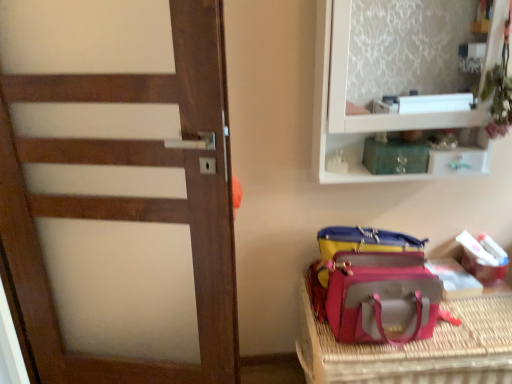
Question: From the image's perspective, does pink fabric bag at lower right appear lower than white glossy cabinet at upper right?

Choices:
 (A) no
 (B) yes

Answer: (B)

Question: Is pink fabric bag at lower right surrounding white glossy cabinet at upper right?

Choices:
 (A) yes
 (B) no

Answer: (B)

Question: Does pink fabric bag at lower right have a smaller size compared to white glossy cabinet at upper right?

Choices:
 (A) no
 (B) yes

Answer: (B)

Question: Is pink fabric bag at lower right not close to white glossy cabinet at upper right?

Choices:
 (A) yes
 (B) no

Answer: (B)

Question: Does pink fabric bag at lower right have a lesser height compared to white glossy cabinet at upper right?

Choices:
 (A) yes
 (B) no

Answer: (A)

Question: Is pink fabric bag at lower right facing away from white glossy cabinet at upper right?

Choices:
 (A) no
 (B) yes

Answer: (A)

Question: From a real-world perspective, does white cardboard box at lower right, which appears as the 1th kit when viewed from the back, sit lower than white glossy cabinet at upper right?

Choices:
 (A) yes
 (B) no

Answer: (A)

Question: Is white glossy cabinet at upper right surrounded by white cardboard box at lower right, the first kit when ordered from bottom to top?

Choices:
 (A) no
 (B) yes

Answer: (A)

Question: Is the surface of white cardboard box at lower right, which is the 1th kit in right-to-left order, in direct contact with white glossy cabinet at upper right?

Choices:
 (A) yes
 (B) no

Answer: (B)

Question: Is white cardboard box at lower right, marked as the second kit in a front-to-back arrangement, at the left side of white glossy cabinet at upper right?

Choices:
 (A) no
 (B) yes

Answer: (A)

Question: Considering the relative sizes of white cardboard box at lower right, which appears as the 1th kit when viewed from the back, and white glossy cabinet at upper right in the image provided, is white cardboard box at lower right, which appears as the 1th kit when viewed from the back, thinner than white glossy cabinet at upper right?

Choices:
 (A) no
 (B) yes

Answer: (B)

Question: From the image's perspective, is white cardboard box at lower right, which is the 1th kit in right-to-left order, above white glossy cabinet at upper right?

Choices:
 (A) yes
 (B) no

Answer: (B)

Question: From the image's perspective, would you say white cardboard box at lower right, marked as the second kit in a front-to-back arrangement, is positioned over leatherette pet carrier at lower right?

Choices:
 (A) no
 (B) yes

Answer: (B)